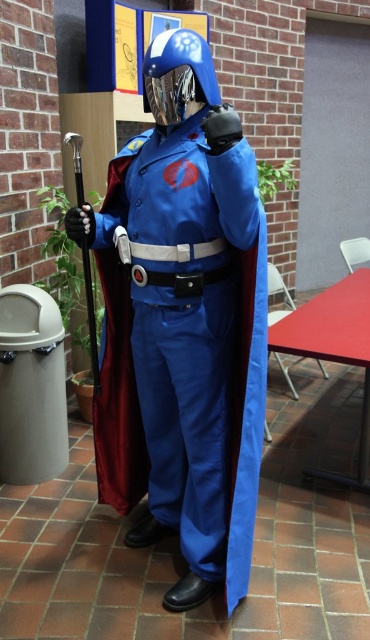
Question: Is matte blue suit at center to the right of blue metallic helmet at center from the viewer's perspective?

Choices:
 (A) no
 (B) yes

Answer: (A)

Question: Which of the following is the closest to the observer?

Choices:
 (A) (159, 124)
 (B) (233, 301)

Answer: (A)

Question: Is the position of matte blue suit at center more distant than that of blue metallic helmet at center?

Choices:
 (A) yes
 (B) no

Answer: (B)

Question: Is matte blue suit at center closer to camera compared to blue metallic helmet at center?

Choices:
 (A) no
 (B) yes

Answer: (B)

Question: Which of the following is the farthest from the observer?

Choices:
 (A) matte blue suit at center
 (B) blue metallic helmet at center

Answer: (B)